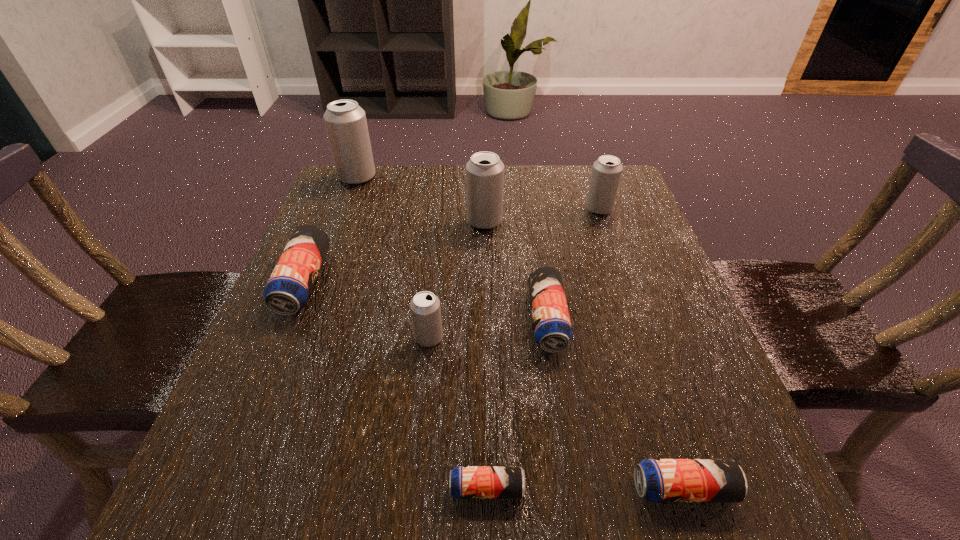
The image size is (960, 540). Identify the location of vacant space that's between the tallest beer can and the seventh tallest beer can. [x=520, y=333].

Locate an element on the screen. This screenshot has height=540, width=960. object that can be found as the third closest to the third blue beer can from left to right is located at coordinates (657, 480).

Choose which object is the sixth nearest neighbor to the third tallest object. Please provide its 2D coordinates. Your answer should be formatted as a tuple, i.e. [(x, y)], where the tuple contains the x and y coordinates of a point satisfying the conditions above.

[(657, 480)]

Where is `the third closest beer can to the leftmost white beer can`? This screenshot has height=540, width=960. the third closest beer can to the leftmost white beer can is located at coordinates (425, 308).

At what (x,y) coordinates should I click in order to perform the action: click on beer can that is the seventh closest to the second smallest blue beer can. Please return your answer as a coordinate pair (x, y). Looking at the image, I should click on (345, 121).

Select which white beer can appears as the third closest to the third smallest white beer can. Please provide its 2D coordinates. Your answer should be formatted as a tuple, i.e. [(x, y)], where the tuple contains the x and y coordinates of a point satisfying the conditions above.

[(425, 308)]

Where is `white beer can identified as the second closest to the second smallest white beer can`? This screenshot has width=960, height=540. white beer can identified as the second closest to the second smallest white beer can is located at coordinates (425, 308).

In order to click on the second closest blue beer can to the seventh shortest beer can in this screenshot , I will do `click(288, 289)`.

Identify which blue beer can is the third nearest to the rightmost white beer can. Please provide its 2D coordinates. Your answer should be formatted as a tuple, i.e. [(x, y)], where the tuple contains the x and y coordinates of a point satisfying the conditions above.

[(657, 480)]

Find the location of `vacant area in the image that satisfies the following two spatial constraints: 1. on the back side of the nearest white beer can; 2. on the left side of the third white beer can from left to right`. vacant area in the image that satisfies the following two spatial constraints: 1. on the back side of the nearest white beer can; 2. on the left side of the third white beer can from left to right is located at coordinates (442, 221).